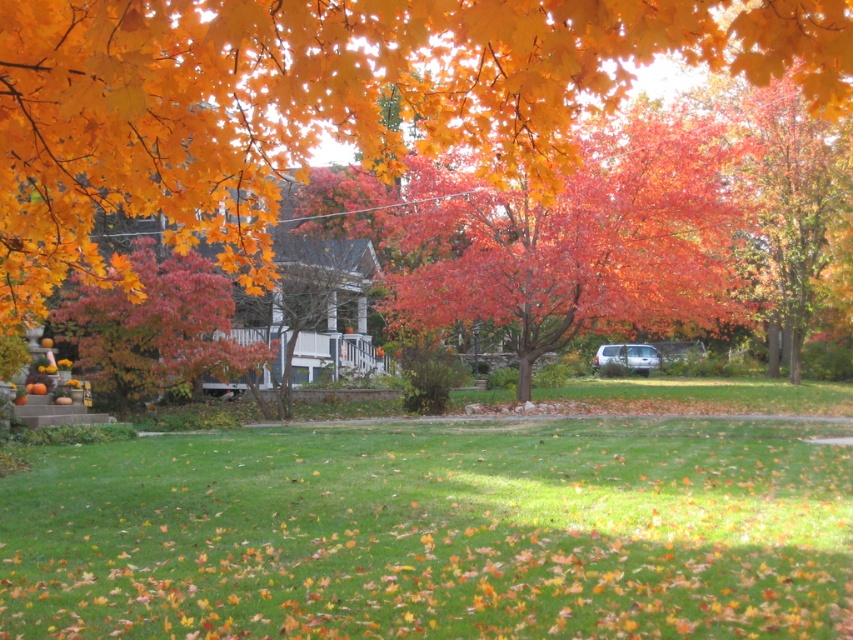
Question: Is orange matte leaves at upper center wider than vivid red leaves at center?

Choices:
 (A) yes
 (B) no

Answer: (A)

Question: Which point is farther to the camera?

Choices:
 (A) (399, 147)
 (B) (422, 252)
 (C) (367, 444)
 (D) (148, 362)

Answer: (B)

Question: Does green grass at lower center have a smaller size compared to vivid red leaves at center?

Choices:
 (A) no
 (B) yes

Answer: (B)

Question: Does orange matte leaves at upper center appear over smooth orange tree at center?

Choices:
 (A) no
 (B) yes

Answer: (B)

Question: Among these points, which one is farthest from the camera?

Choices:
 (A) (154, 269)
 (B) (549, 468)

Answer: (A)

Question: Which object is farther from the camera taking this photo?

Choices:
 (A) smooth orange tree at center
 (B) vivid red leaves at center
 (C) green grass at lower center

Answer: (A)